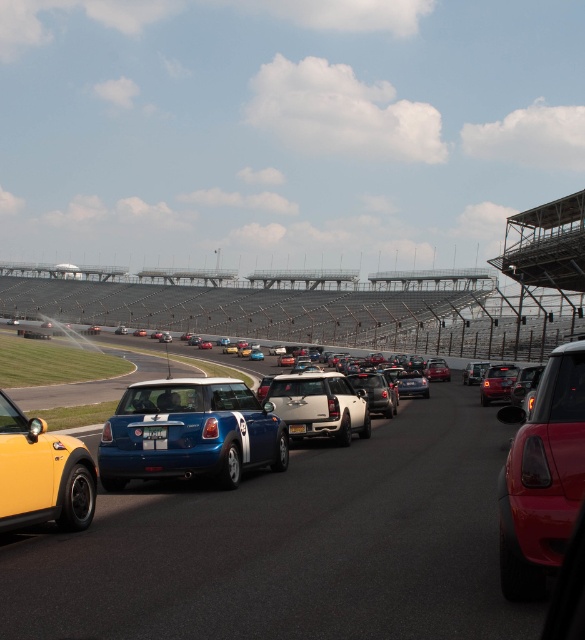
Locate an element on the screen. This screenshot has height=640, width=585. shiny red car at right is located at coordinates (542, 476).

Who is taller, shiny red car at right or satin white suv at center?

With more height is shiny red car at right.

The image size is (585, 640). What are the coordinates of `shiny red car at right` in the screenshot? It's located at (542, 476).

Where is `shiny red car at right`? This screenshot has height=640, width=585. shiny red car at right is located at coordinates (542, 476).

Between smooth asphalt race track at center and shiny blue car at center, which one is positioned lower?

Positioned lower is smooth asphalt race track at center.

Can you confirm if smooth asphalt race track at center is taller than shiny blue car at center?

Indeed, smooth asphalt race track at center has a greater height compared to shiny blue car at center.

Is point (364, 572) farther from viewer compared to point (133, 452)?

No, (364, 572) is in front of (133, 452).

The height and width of the screenshot is (640, 585). What are the coordinates of `smooth asphalt race track at center` in the screenshot? It's located at (291, 545).

How much distance is there between satin white suv at center and yellow plastic license plate at center?

satin white suv at center and yellow plastic license plate at center are 18.35 inches apart from each other.

Does point (338, 378) come farther from viewer compared to point (290, 433)?

Yes, it is.

Image resolution: width=585 pixels, height=640 pixels. Find the location of `satin white suv at center`. satin white suv at center is located at coordinates (321, 404).